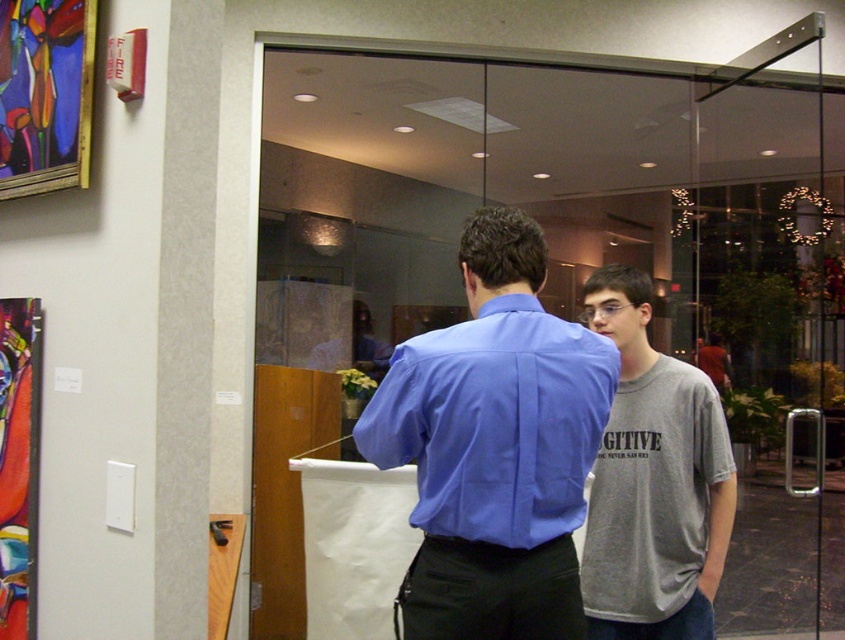
You are an interior designer assessing the office layout. You need to determine if the matte blue dress shirt at center can be placed on a shelf designed for items narrower than the abstract painting at left. Can it fit?

The matte blue dress shirt at center is wider than the abstract painting at left, so it cannot fit on the shelf designed for items narrower than the abstract painting at left.